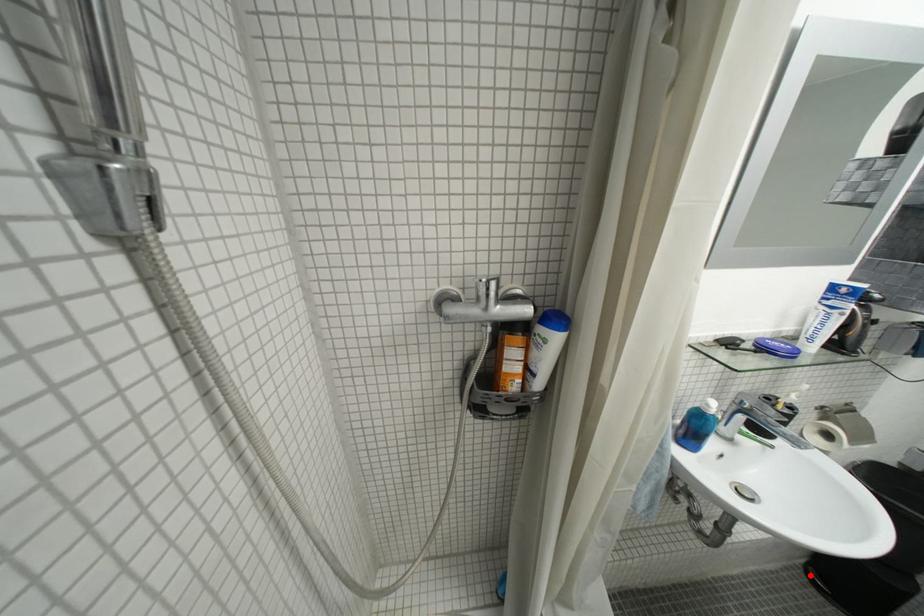
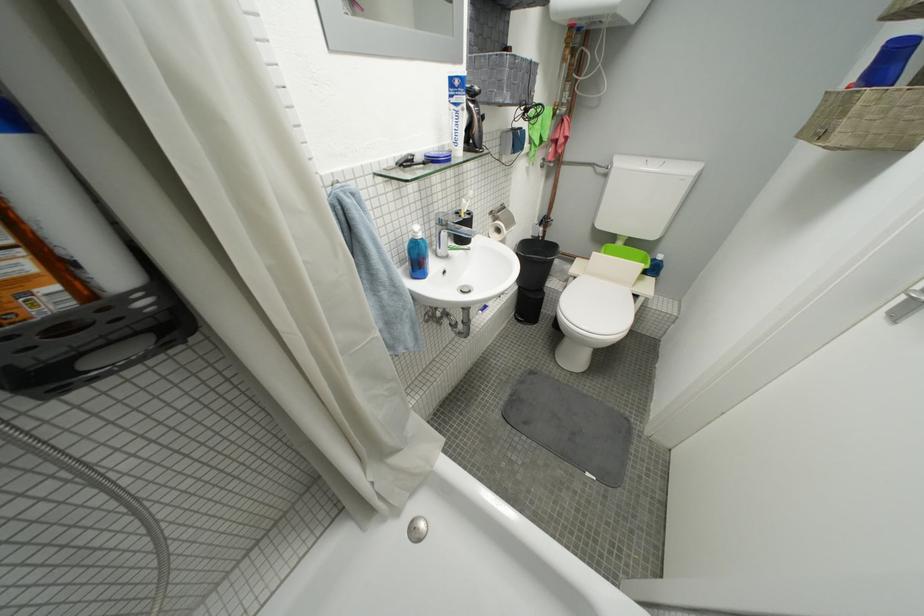
Locate, in the second image, the point that corresponds to the highlighted location in the first image.

(523, 322)